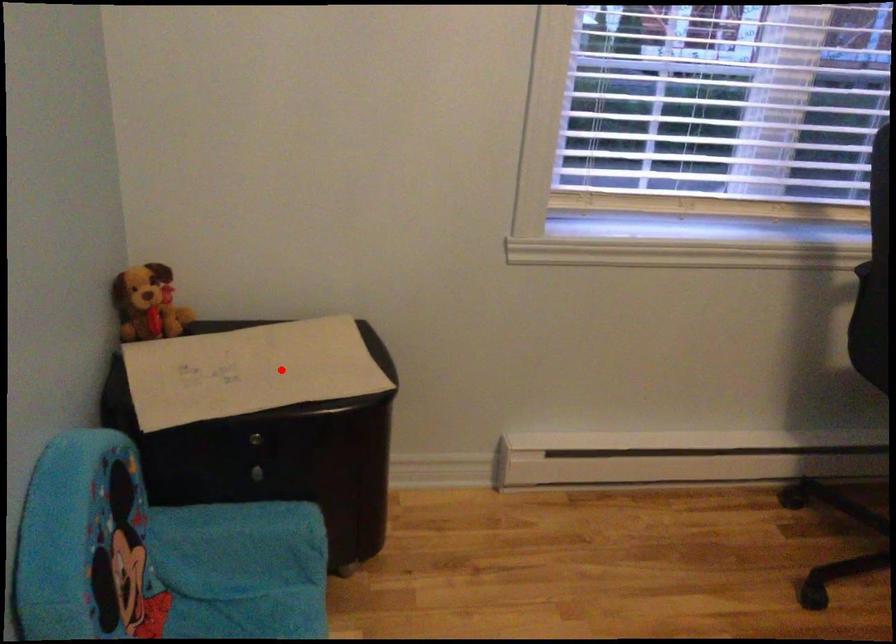
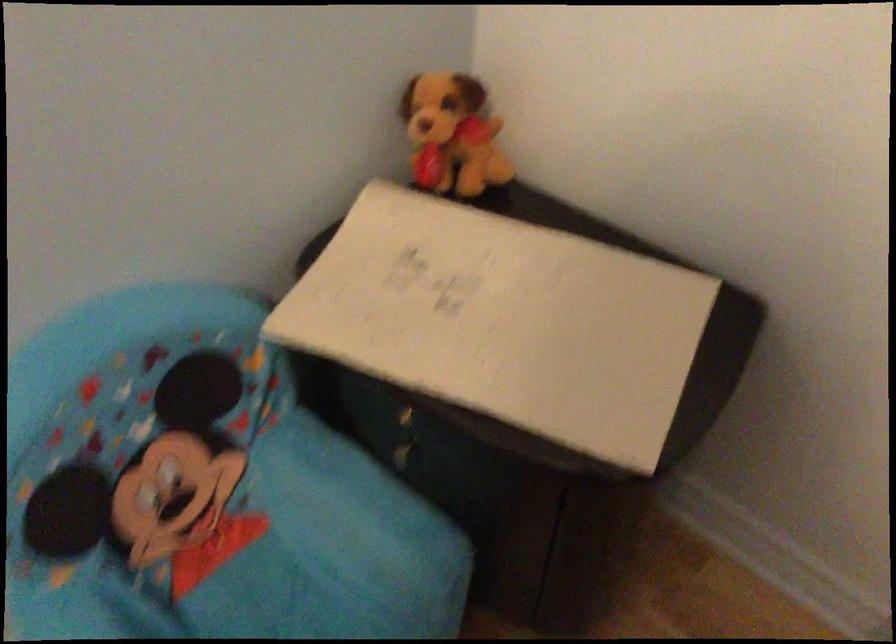
The point at the highlighted location is marked in the first image. Where is the corresponding point in the second image?

(521, 323)